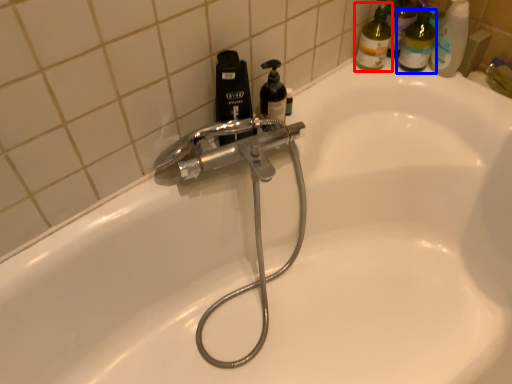
Question: Which object appears farthest to the camera in this image, cleaning product (highlighted by a red box) or toiletry (highlighted by a blue box)?

Choices:
 (A) cleaning product
 (B) toiletry

Answer: (A)